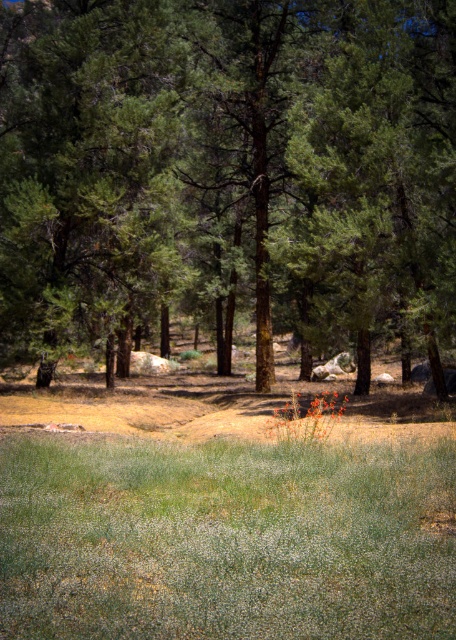
Question: From the image, what is the correct spatial relationship of green textured tree at center in relation to green soft grass at lower center?

Choices:
 (A) below
 (B) above

Answer: (B)

Question: Does green textured tree at center appear under green soft grass at lower center?

Choices:
 (A) no
 (B) yes

Answer: (A)

Question: Can you confirm if green textured tree at center is positioned above green soft grass at lower center?

Choices:
 (A) yes
 (B) no

Answer: (A)

Question: Which point is farther to the camera?

Choices:
 (A) (51, 572)
 (B) (268, 285)

Answer: (B)

Question: Which object is closer to the camera taking this photo?

Choices:
 (A) green textured tree at center
 (B) green soft grass at lower center

Answer: (B)